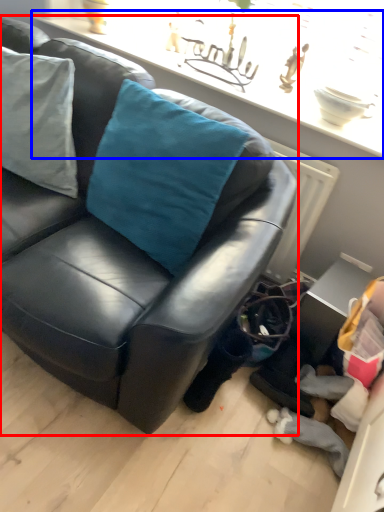
Question: Which of the following is the closest to the observer, studio couch (highlighted by a red box) or window sill (highlighted by a blue box)?

Choices:
 (A) studio couch
 (B) window sill

Answer: (A)